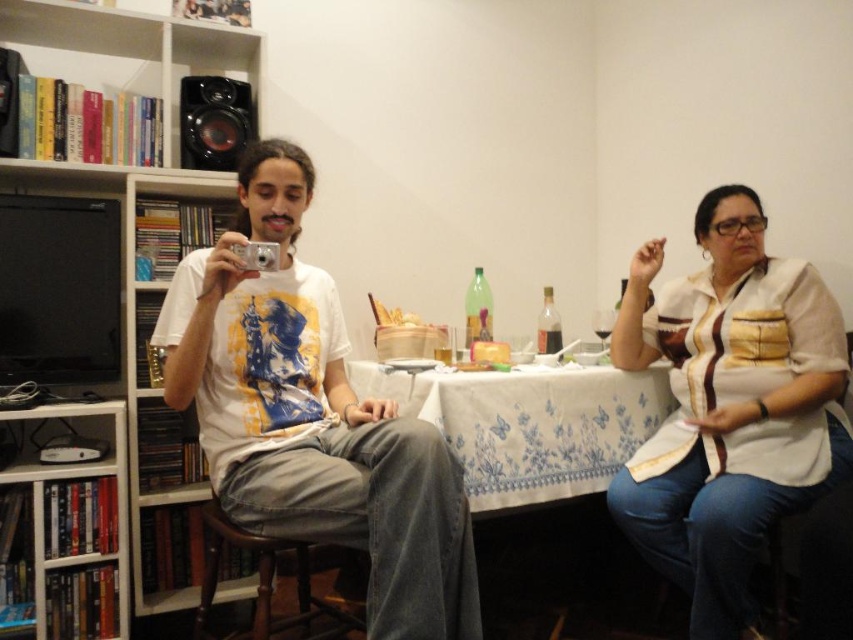
Does white floral tablecloth at center appear over brown wooden chair at lower left?

Yes.

Between white floral tablecloth at center and brown wooden chair at lower left, which one appears on the right side from the viewer's perspective?

From the viewer's perspective, white floral tablecloth at center appears more on the right side.

Is point (602, 474) closer to viewer compared to point (361, 628)?

No.

Find the location of a particular element. This screenshot has width=853, height=640. white floral tablecloth at center is located at coordinates (529, 422).

Which is above, white cotton shirt at center or brown wooden chair at lower left?

white cotton shirt at center is above.

Is point (364, 436) positioned in front of point (335, 624)?

Yes, point (364, 436) is in front of point (335, 624).

Find the location of `white cotton shirt at center`. white cotton shirt at center is located at coordinates [312, 416].

Where is `white cotton shirt at center`? The width and height of the screenshot is (853, 640). white cotton shirt at center is located at coordinates (312, 416).

Does white wood bookcase at left have a smaller size compared to white floral tablecloth at center?

No.

Does white wood bookcase at left appear under white floral tablecloth at center?

No, white wood bookcase at left is not below white floral tablecloth at center.

Identify the location of white wood bookcase at left. The height and width of the screenshot is (640, 853). (132, 168).

Find the location of a particular element. white wood bookcase at left is located at coordinates (132, 168).